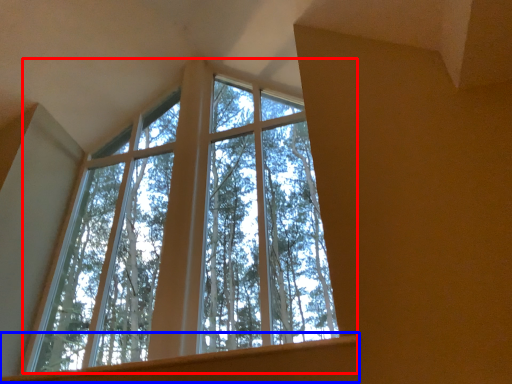
Question: Which point is further to the camera, window (highlighted by a red box) or window sill (highlighted by a blue box)?

Choices:
 (A) window
 (B) window sill

Answer: (A)